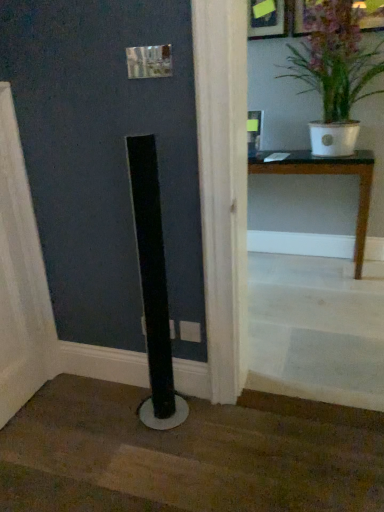
Question: Could black matte pole at lower center, positioned as the first stairwell in bottom-to-top order, be considered to be inside white glossy pot at upper right?

Choices:
 (A) no
 (B) yes

Answer: (A)

Question: Does white glossy pot at upper right have a smaller size compared to black matte pole at lower center, positioned as the first stairwell in bottom-to-top order?

Choices:
 (A) yes
 (B) no

Answer: (B)

Question: Can you confirm if white glossy pot at upper right is taller than black matte pole at lower center, which appears as the 2th stairwell when viewed from the top?

Choices:
 (A) no
 (B) yes

Answer: (B)

Question: Can we say white glossy pot at upper right lies outside black matte pole at lower center, which appears as the 2th stairwell when viewed from the top?

Choices:
 (A) no
 (B) yes

Answer: (B)

Question: Considering the relative sizes of white glossy pot at upper right and black matte pole at lower center, which appears as the 2th stairwell when viewed from the top, in the image provided, is white glossy pot at upper right shorter than black matte pole at lower center, which appears as the 2th stairwell when viewed from the top,?

Choices:
 (A) no
 (B) yes

Answer: (A)

Question: In terms of width, does wooden table at center look wider or thinner when compared to white wooden stairs at lower right, the 2th stairwell in the bottom-to-top sequence?

Choices:
 (A) wide
 (B) thin

Answer: (B)

Question: Considering the relative positions of wooden table at center and white wooden stairs at lower right, the 2th stairwell in the bottom-to-top sequence, in the image provided, is wooden table at center to the left or to the right of white wooden stairs at lower right, the 2th stairwell in the bottom-to-top sequence,?

Choices:
 (A) left
 (B) right

Answer: (B)

Question: Is point (362, 231) closer or farther from the camera than point (274, 279)?

Choices:
 (A) closer
 (B) farther

Answer: (A)

Question: From a real-world perspective, is wooden table at center physically located above or below white wooden stairs at lower right, which is the first stairwell from top to bottom?

Choices:
 (A) above
 (B) below

Answer: (A)

Question: Is wooden table at center taller or shorter than black matte pole at lower center, which appears as the 2th stairwell when viewed from the top?

Choices:
 (A) tall
 (B) short

Answer: (A)

Question: Is wooden table at center spatially inside black matte pole at lower center, which appears as the 2th stairwell when viewed from the top, or outside of it?

Choices:
 (A) outside
 (B) inside

Answer: (A)

Question: From a real-world perspective, is wooden table at center positioned above or below black matte pole at lower center, which appears as the 2th stairwell when viewed from the top?

Choices:
 (A) above
 (B) below

Answer: (A)

Question: From the image's perspective, is wooden table at center positioned above or below black matte pole at lower center, which appears as the 2th stairwell when viewed from the top?

Choices:
 (A) above
 (B) below

Answer: (A)

Question: Would you say white glossy pot at upper right is to the left or to the right of black matte pole at lower center, positioned as the first stairwell in bottom-to-top order, in the picture?

Choices:
 (A) left
 (B) right

Answer: (B)

Question: In terms of width, does white glossy pot at upper right look wider or thinner when compared to black matte pole at lower center, which appears as the 2th stairwell when viewed from the top?

Choices:
 (A) thin
 (B) wide

Answer: (A)